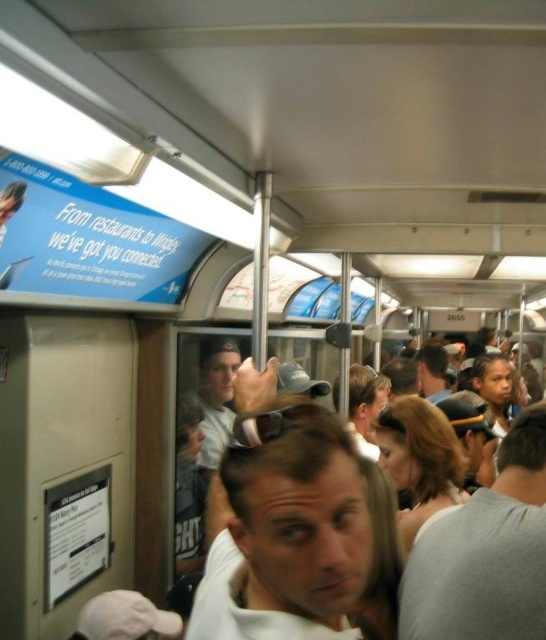
You are standing in the subway car and want to locate the white matte shirt at center. According to the coordinates given, where should you look?

The white matte shirt at center is located at point (x=287, y=531).

You are standing in the subway car and want to find the white matte shirt at center. According to the coordinates provided, where should you look relative to the subway car?

The white matte shirt at center is located at coordinates point 0.830 on the x axis and 0.527 on the y axis.